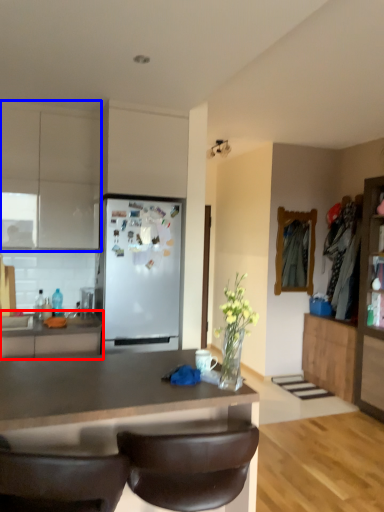
Question: Which object appears farthest to the camera in this image, cabinetry (highlighted by a red box) or cabinetry (highlighted by a blue box)?

Choices:
 (A) cabinetry
 (B) cabinetry

Answer: (B)